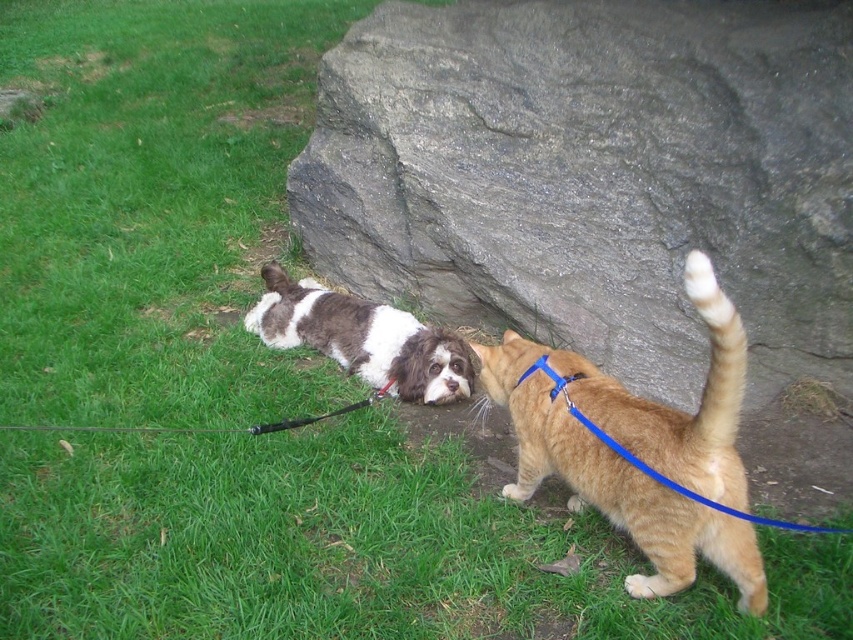
In the scene shown: You are a dog owner who just noticed your dog is lying on the grass with its leash still attached. You want to retrieve the black rubber leash at lower center without disturbing the orange tabby cat at lower right. Can you reach the leash from where you are standing?

The orange tabby cat at lower right is 3.80 feet away from the black rubber leash at lower center. Since the cat is 3.80 feet away from the leash, you can safely reach the leash without disturbing the cat as long as you keep a distance of at least 3.80 feet away from the cat.

Based on the photo, you are a photographer trying to capture a photo of the orange tabby cat at lower right. The camera you are using has a focus point at coordinate point (642, 449). Will the orange tabby cat at lower right be in focus?

The orange tabby cat at lower right is located at point (642, 449), so yes, the orange tabby cat at lower right will be in focus since the focus point is exactly at its location.